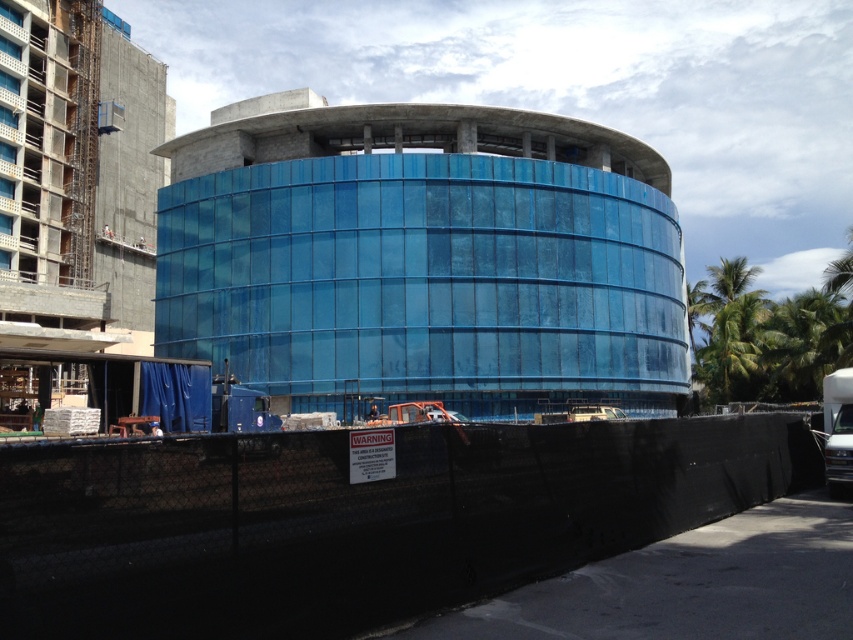
Question: Which of the following is the closest to the observer?

Choices:
 (A) (113, 237)
 (B) (273, 477)
 (C) (747, 360)
 (D) (212, 339)

Answer: (B)

Question: Which of the following is the closest to the observer?

Choices:
 (A) green leafy palm tree at right
 (B) transparent glass building at center
 (C) black mesh fence at lower center
 (D) red shirt construction worker at center

Answer: (C)

Question: Can you confirm if transparent glass building at center is positioned to the left of green leafy palm tree at right?

Choices:
 (A) no
 (B) yes

Answer: (B)

Question: Estimate the real-world distances between objects in this image. Which object is closer to the black mesh fence at lower center?

Choices:
 (A) transparent glass building at center
 (B) red shirt construction worker at center

Answer: (A)

Question: In this image, where is black mesh fence at lower center located relative to red shirt construction worker at center?

Choices:
 (A) right
 (B) left

Answer: (A)

Question: Where is transparent glass building at center located in relation to green leafy palm tree at right in the image?

Choices:
 (A) right
 (B) left

Answer: (B)